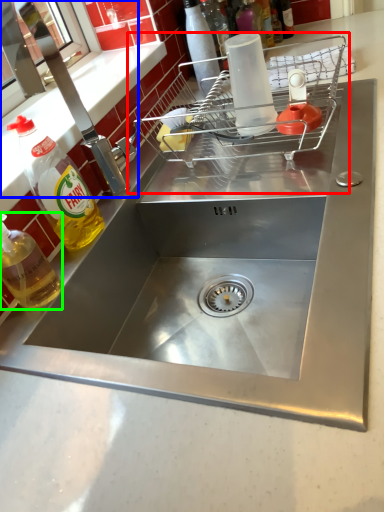
Question: Which is farther away from appliance (highlighted by a red box)? tap (highlighted by a blue box) or bottle (highlighted by a green box)?

Choices:
 (A) tap
 (B) bottle

Answer: (B)